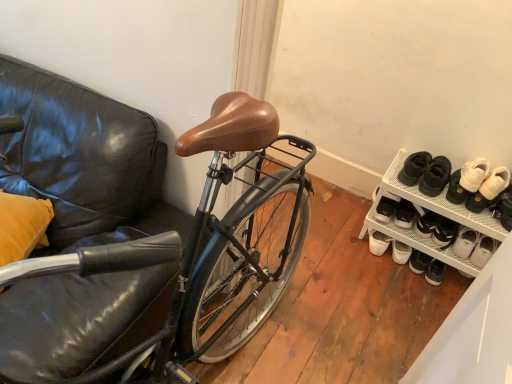
Locate an element on the screen. blank space to the left of white mesh shoe rack at lower right is located at coordinates (338, 238).